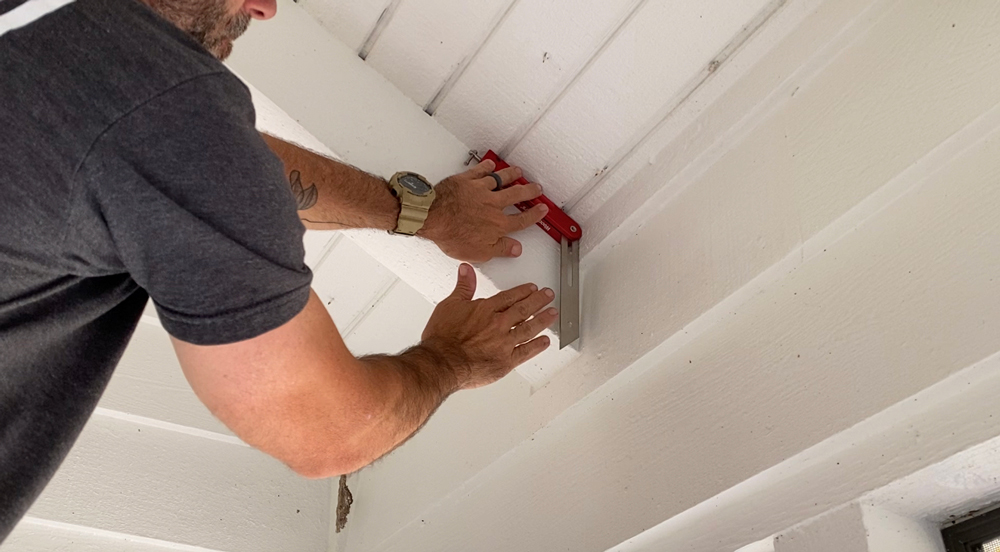
This screenshot has height=552, width=1000. What are the coordinates of `clock hands` in the screenshot? It's located at (410, 184).